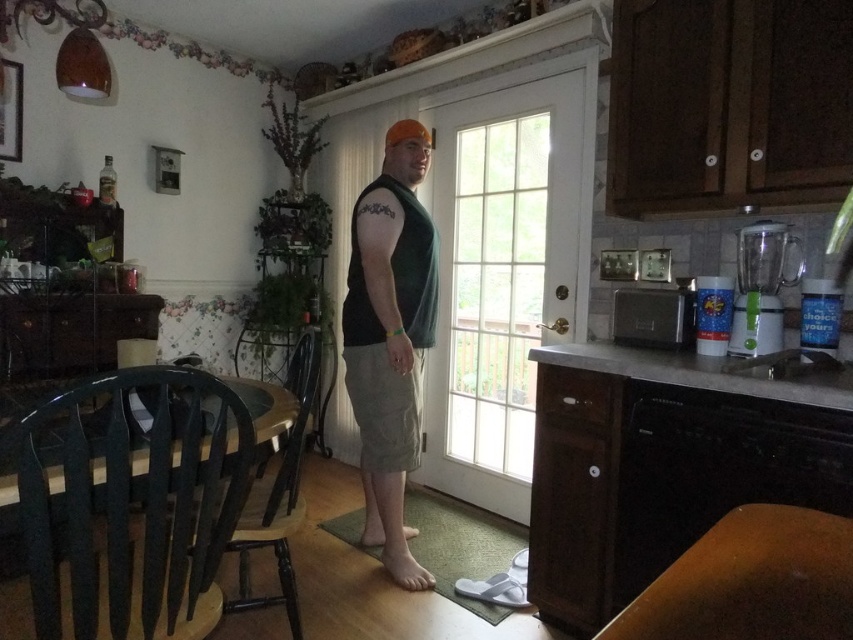
Question: Which of the following is the farthest from the observer?

Choices:
 (A) green plastic chair at lower left
 (B) green matte tank top at center
 (C) black plastic chair at left

Answer: (B)

Question: Estimate the real-world distances between objects in this image. Which object is farther from the green plastic chair at lower left?

Choices:
 (A) green matte tank top at center
 (B) clear glass door at center

Answer: (B)

Question: Which point is farther to the camera?

Choices:
 (A) (55, 592)
 (B) (498, 189)
 (C) (419, 588)
 (D) (297, 636)

Answer: (B)

Question: Where is clear glass door at center located in relation to green matte tank top at center in the image?

Choices:
 (A) right
 (B) left

Answer: (A)

Question: Does clear glass door at center appear on the right side of green matte tank top at center?

Choices:
 (A) no
 (B) yes

Answer: (B)

Question: Considering the relative positions of green plastic chair at lower left and green matte tank top at center in the image provided, where is green plastic chair at lower left located with respect to green matte tank top at center?

Choices:
 (A) right
 (B) left

Answer: (B)